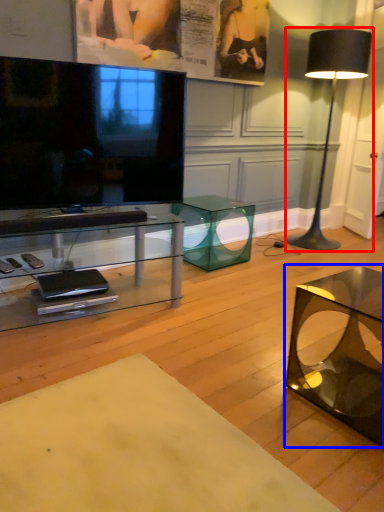
Question: Which object appears closest to the camera in this image, lamp (highlighted by a red box) or coffee table (highlighted by a blue box)?

Choices:
 (A) lamp
 (B) coffee table

Answer: (B)